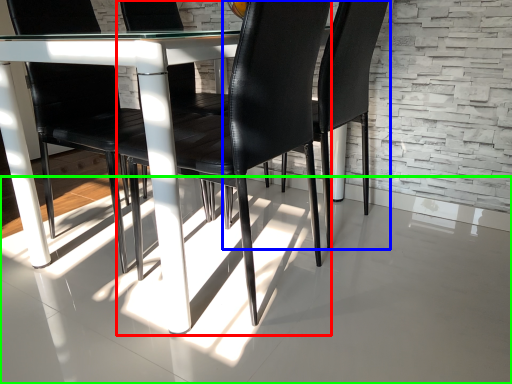
Question: Based on their relative distances, which object is nearer to chair (highlighted by a red box)? Choose from chair (highlighted by a blue box) and concrete (highlighted by a green box).

Choices:
 (A) chair
 (B) concrete

Answer: (B)